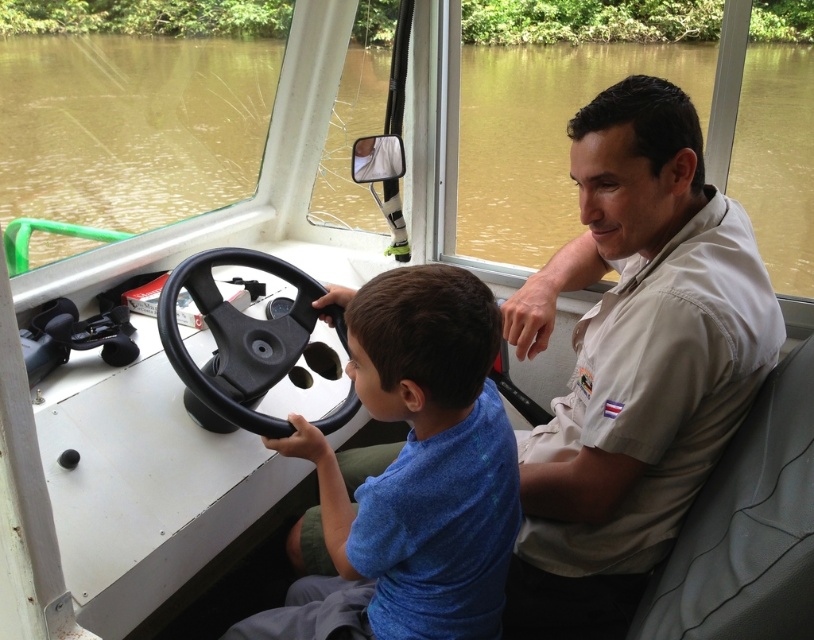
Who is higher up, white cotton shirt at right or blue matte shirt at center?

white cotton shirt at right is higher up.

Is white cotton shirt at right above blue matte shirt at center?

Correct, white cotton shirt at right is located above blue matte shirt at center.

Locate an element on the screen. The width and height of the screenshot is (814, 640). white cotton shirt at right is located at coordinates (633, 362).

Locate an element on the screen. white cotton shirt at right is located at coordinates (633, 362).

Does brown murky water at upper center appear on the right side of white cotton shirt at right?

Correct, you'll find brown murky water at upper center to the right of white cotton shirt at right.

Identify the location of brown murky water at upper center. (130, 125).

Between brown murky water at upper center and black rubber steering wheel at center, which one appears on the left side from the viewer's perspective?

black rubber steering wheel at center is more to the left.

Who is taller, brown murky water at upper center or black rubber steering wheel at center?

With more height is brown murky water at upper center.

Locate an element on the screen. brown murky water at upper center is located at coordinates (130, 125).